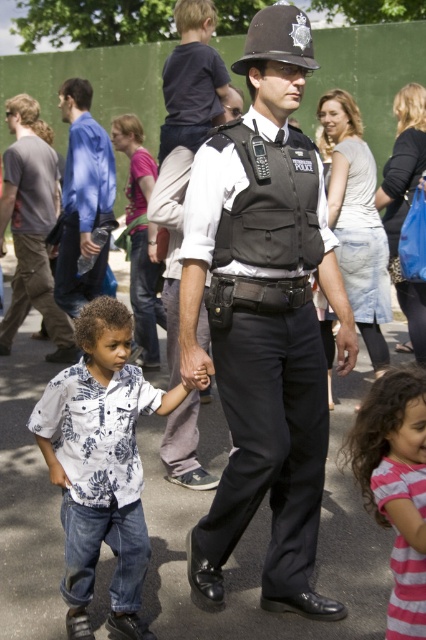
Measure the distance between point (287, 67) and camera.

Point (287, 67) and camera are 10.27 feet apart from each other.

Is point (236, 488) positioned in front of point (150, 257)?

Yes, it is in front of point (150, 257).

Locate an element on the screen. This screenshot has height=640, width=426. black uniformed police officer at center is located at coordinates (258, 337).

Between black uniformed police officer at center and pink striped dress at lower right, which one appears on the left side from the viewer's perspective?

From the viewer's perspective, black uniformed police officer at center appears more on the left side.

Is point (284, 131) farther from camera compared to point (414, 557)?

That is True.

Where is `black uniformed police officer at center`? The width and height of the screenshot is (426, 640). black uniformed police officer at center is located at coordinates (258, 337).

The width and height of the screenshot is (426, 640). Find the location of `gray cotton shirt at left`. gray cotton shirt at left is located at coordinates (31, 228).

Locate an element on the screen. The width and height of the screenshot is (426, 640). gray cotton shirt at left is located at coordinates (31, 228).